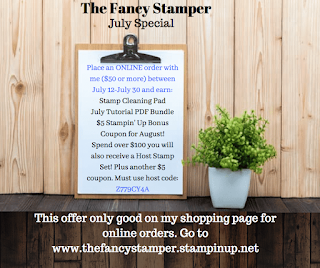
In order to click on space between clipboard and plant in this screenshot , I will do `click(196, 175)`.